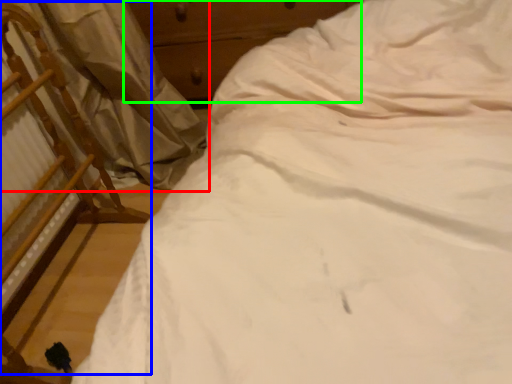
Question: Considering the real-world distances, which object is farthest from curtain (highlighted by a red box)? chair (highlighted by a blue box) or dresser (highlighted by a green box)?

Choices:
 (A) chair
 (B) dresser

Answer: (B)